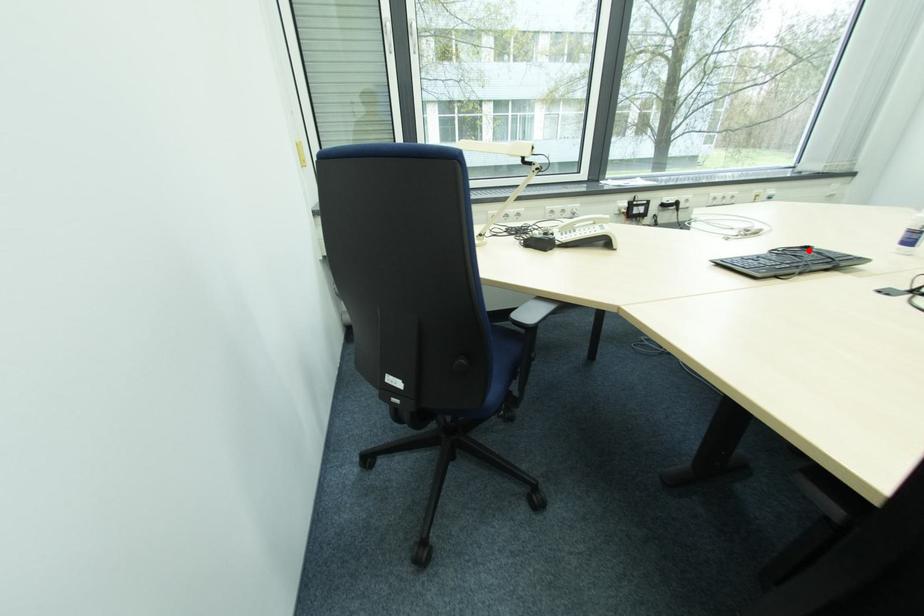
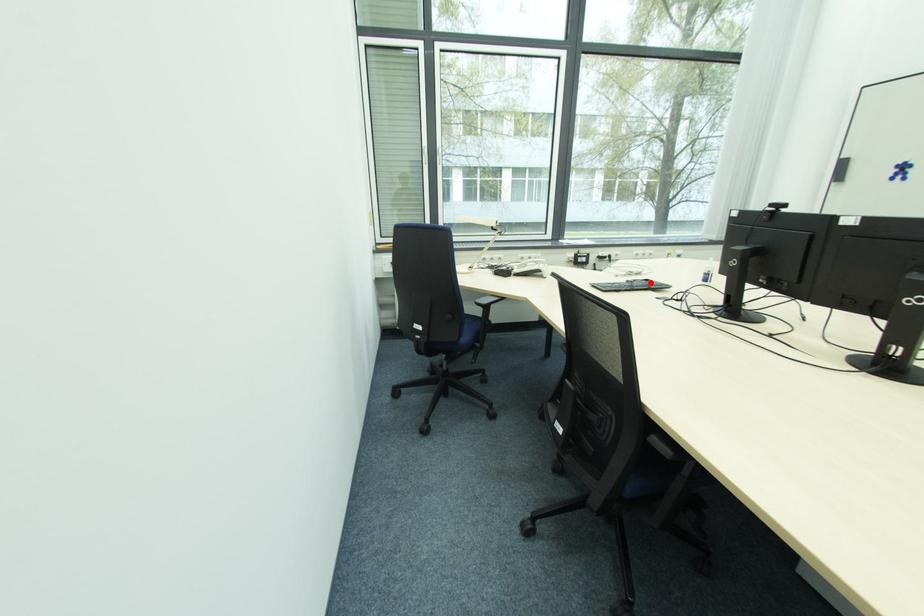
I am providing you with two images of the same scene from different viewpoints. A red point is marked on the first image and another point is marked on the second image. Does the point marked in image1 correspond to the same location as the one in image2?

Yes